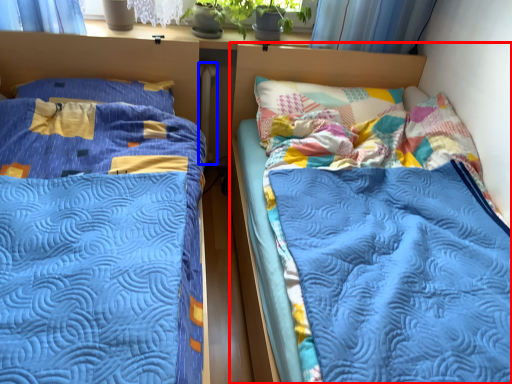
Question: Among these objects, which one is farthest to the camera, bed (highlighted by a red box) or radiator (highlighted by a blue box)?

Choices:
 (A) bed
 (B) radiator

Answer: (B)